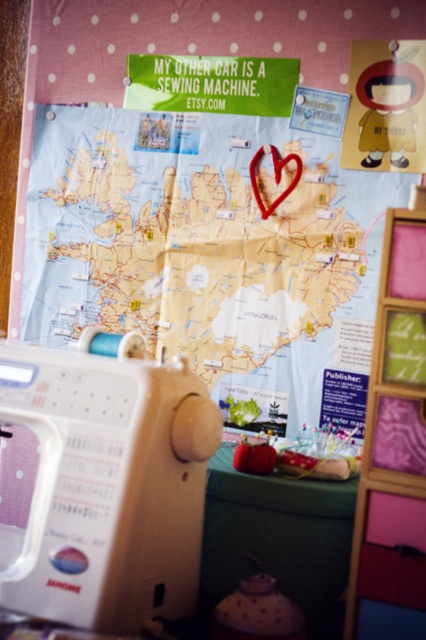
Question: Based on their relative distances, which object is farther from the wooden frame at center?

Choices:
 (A) green fabric table at lower center
 (B) light blue paper map at center

Answer: (B)

Question: Does beige plastic sewing machine at lower left lie behind wooden frame at center?

Choices:
 (A) yes
 (B) no

Answer: (B)

Question: Is beige plastic sewing machine at lower left to the right of green fabric table at lower center from the viewer's perspective?

Choices:
 (A) yes
 (B) no

Answer: (B)

Question: Which object appears farthest from the camera in this image?

Choices:
 (A) beige plastic sewing machine at lower left
 (B) light blue paper map at center
 (C) wooden frame at center

Answer: (B)

Question: Among these objects, which one is nearest to the camera?

Choices:
 (A) wooden frame at center
 (B) green fabric table at lower center
 (C) beige plastic sewing machine at lower left
 (D) light blue paper map at center

Answer: (C)

Question: Does beige plastic sewing machine at lower left appear over green fabric table at lower center?

Choices:
 (A) no
 (B) yes

Answer: (B)